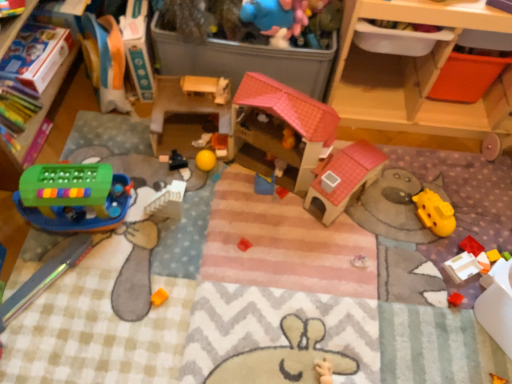
Locate an element on the screen. The width and height of the screenshot is (512, 384). vacant area that lies between bright red plastic block at lower right, which appears as the first toy when viewed from the right, and metallic blue car at center, which appears as the 8th toy when viewed from the right is located at coordinates (337, 218).